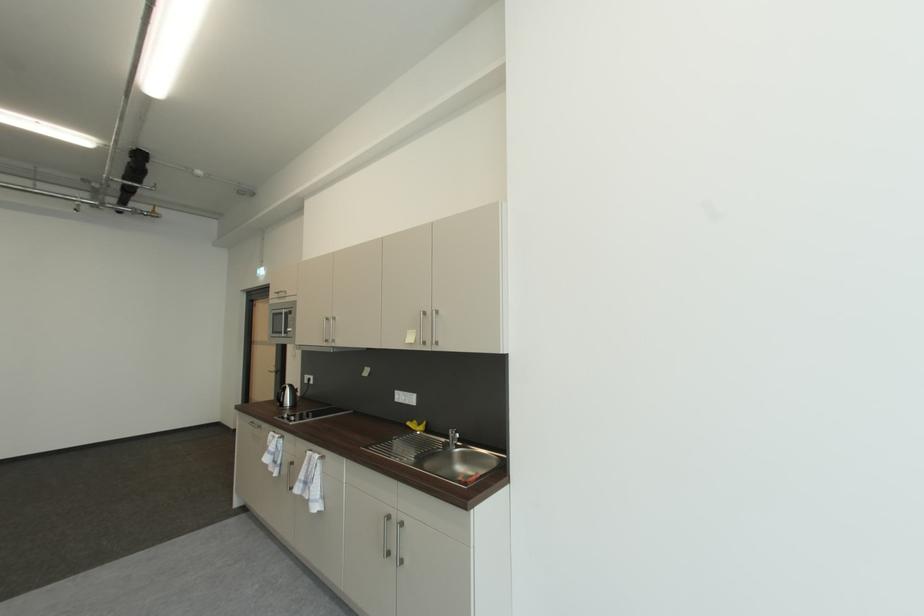
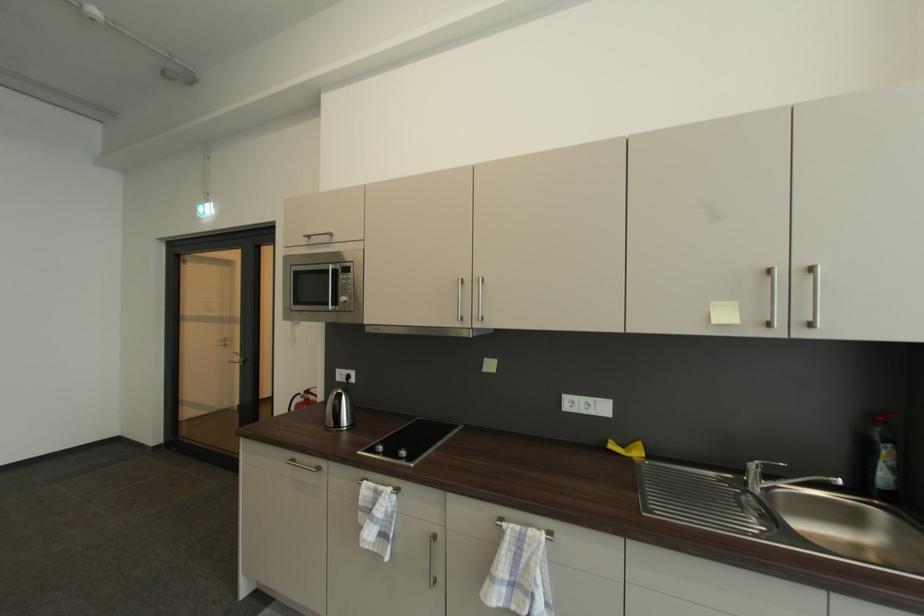
In the second image, find the point that corresponds to point 431,315 in the first image.

(774, 272)